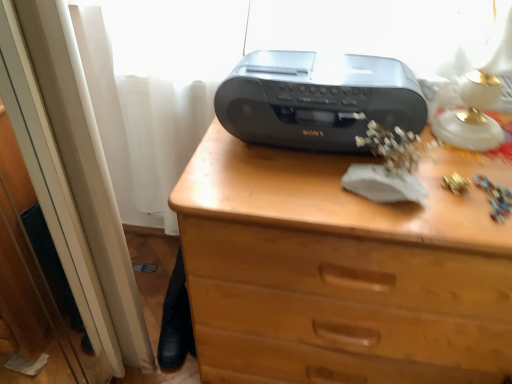
Question: Is point (466, 279) closer or farther from the camera than point (376, 97)?

Choices:
 (A) farther
 (B) closer

Answer: (B)

Question: Relative to satin black radio at center, is brown wooden chest of drawers at center in front or behind?

Choices:
 (A) behind
 (B) front

Answer: (B)

Question: Which object is the farthest from the satin black radio at center?

Choices:
 (A) brown wooden chest of drawers at center
 (B) white glossy table lamp at upper right

Answer: (B)

Question: Which of these objects is positioned closest to the satin black radio at center?

Choices:
 (A) white glossy table lamp at upper right
 (B) brown wooden chest of drawers at center

Answer: (B)